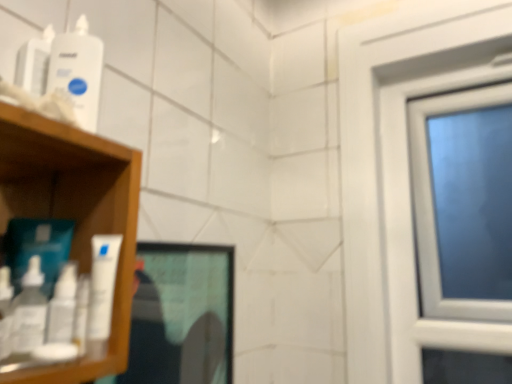
Question: Is white glossy mouthwash at left, which is the 1th mouthwash in bottom-to-top order, closer to camera compared to white glossy tube at left, the 2th mouthwash viewed from the top?

Choices:
 (A) yes
 (B) no

Answer: (A)

Question: Is white glossy mouthwash at left, placed as the third mouthwash when sorted from top to bottom, outside of white glossy tube at left, the 2th mouthwash viewed from the top?

Choices:
 (A) yes
 (B) no

Answer: (A)

Question: Can white glossy tube at left, the 2th mouthwash viewed from the top, be found inside white glossy mouthwash at left, which is the 1th mouthwash in bottom-to-top order?

Choices:
 (A) no
 (B) yes

Answer: (A)

Question: Considering the relative sizes of white glossy mouthwash at left, placed as the third mouthwash when sorted from top to bottom, and white glossy tube at left, the second mouthwash ordered from the bottom, in the image provided, is white glossy mouthwash at left, placed as the third mouthwash when sorted from top to bottom, taller than white glossy tube at left, the second mouthwash ordered from the bottom,?

Choices:
 (A) no
 (B) yes

Answer: (A)

Question: Is white glossy mouthwash at left, placed as the third mouthwash when sorted from top to bottom, with white glossy tube at left, the 2th mouthwash viewed from the top?

Choices:
 (A) yes
 (B) no

Answer: (A)

Question: Does white glossy mouthwash at left, which is the 1th mouthwash in bottom-to-top order, have a lesser height compared to white glossy tube at left, the 2th mouthwash viewed from the top?

Choices:
 (A) yes
 (B) no

Answer: (A)

Question: From a real-world perspective, does white glossy tube at left, the 2th mouthwash viewed from the top, stand above white plastic bottle at upper left, the 3th mouthwash positioned from the bottom?

Choices:
 (A) yes
 (B) no

Answer: (B)

Question: Is white glossy tube at left, the second mouthwash ordered from the bottom, positioned with its back to white plastic bottle at upper left, the 3th mouthwash positioned from the bottom?

Choices:
 (A) no
 (B) yes

Answer: (A)

Question: From the image's perspective, is white glossy tube at left, the 2th mouthwash viewed from the top, above white plastic bottle at upper left, which is the first mouthwash in top-to-bottom order?

Choices:
 (A) no
 (B) yes

Answer: (A)

Question: Does white glossy tube at left, the second mouthwash ordered from the bottom, have a greater height compared to white plastic bottle at upper left, the 3th mouthwash positioned from the bottom?

Choices:
 (A) yes
 (B) no

Answer: (B)

Question: Is white glossy tube at left, the second mouthwash ordered from the bottom, wider than white plastic bottle at upper left, the 3th mouthwash positioned from the bottom?

Choices:
 (A) no
 (B) yes

Answer: (A)

Question: Is white plastic bottle at upper left, the 3th mouthwash positioned from the bottom, inside white glossy tube at left, the second mouthwash ordered from the bottom?

Choices:
 (A) yes
 (B) no

Answer: (B)

Question: Is white plastic bottle at upper left, which is the first mouthwash in top-to-bottom order, oriented away from white glossy tube at left, the 2th mouthwash viewed from the top?

Choices:
 (A) yes
 (B) no

Answer: (B)